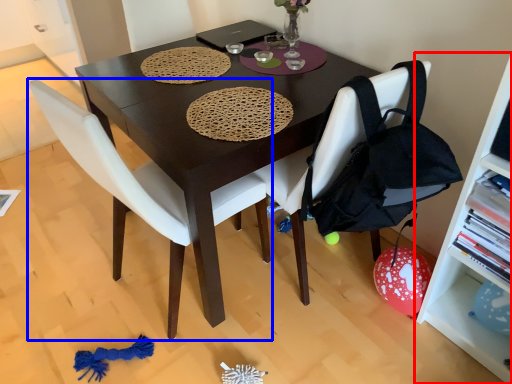
Question: Which of the following is the closest to the observer, shelf (highlighted by a red box) or chair (highlighted by a blue box)?

Choices:
 (A) shelf
 (B) chair

Answer: (A)